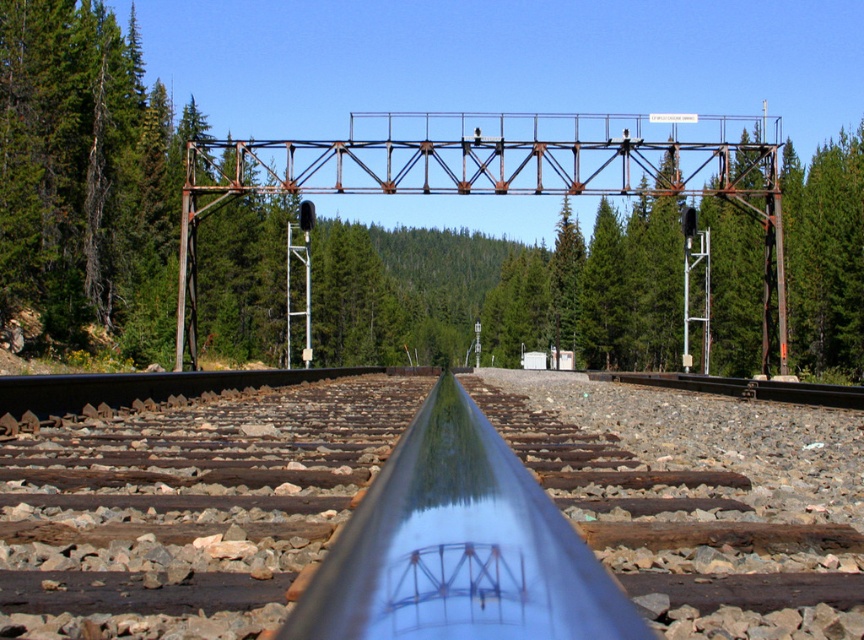
Question: Is green leafy forest at upper center positioned at the back of metal at center?

Choices:
 (A) yes
 (B) no

Answer: (A)

Question: Which point is farther from the camera taking this photo?

Choices:
 (A) (780, 148)
 (B) (687, 426)

Answer: (A)

Question: Among these points, which one is farthest from the camera?

Choices:
 (A) (564, 413)
 (B) (646, 292)

Answer: (B)

Question: Is green leafy forest at upper center to the left of metal at center from the viewer's perspective?

Choices:
 (A) yes
 (B) no

Answer: (B)

Question: Does green leafy forest at upper center have a lesser width compared to metal at center?

Choices:
 (A) no
 (B) yes

Answer: (A)

Question: Which object appears closest to the camera in this image?

Choices:
 (A) metal at center
 (B) green leafy forest at upper center

Answer: (A)